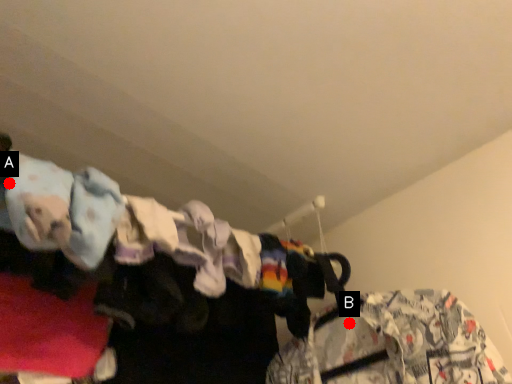
Question: Two points are circled on the image, labeled by A and B beside each circle. Which point is farther from the camera taking this photo?

Choices:
 (A) A is further
 (B) B is further

Answer: (B)